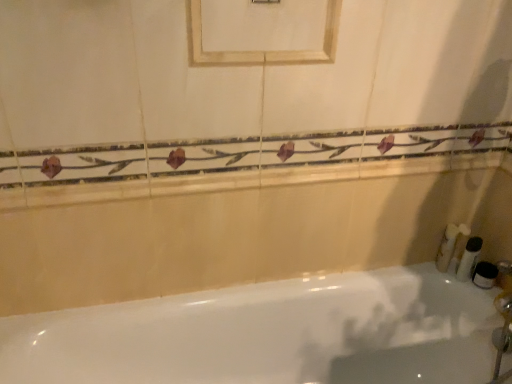
Question: Does white plastic bottle at right, acting as the third toiletry starting from the left, have a lesser width compared to white matte toothbrushes at right, which is the third toiletry from right to left?

Choices:
 (A) no
 (B) yes

Answer: (B)

Question: Can we say white plastic bottle at right, the second toiletry from the right, lies outside white matte toothbrushes at right, which is the third toiletry from right to left?

Choices:
 (A) yes
 (B) no

Answer: (A)

Question: From the image's perspective, is white plastic bottle at right, acting as the third toiletry starting from the left, located beneath white matte toothbrushes at right, which is the third toiletry from right to left?

Choices:
 (A) no
 (B) yes

Answer: (B)

Question: Does white plastic bottle at right, the second toiletry from the right, appear on the right side of white matte toothbrushes at right, which is the third toiletry from right to left?

Choices:
 (A) no
 (B) yes

Answer: (B)

Question: Considering the relative sizes of white plastic bottle at right, the second toiletry from the right, and white matte toothbrushes at right, which is the 2th toiletry in left-to-right order, in the image provided, is white plastic bottle at right, the second toiletry from the right, taller than white matte toothbrushes at right, which is the 2th toiletry in left-to-right order,?

Choices:
 (A) yes
 (B) no

Answer: (B)

Question: From the image's perspective, is white plastic bottle at right, acting as the third toiletry starting from the left, on top of white matte toothbrushes at right, which is the 2th toiletry in left-to-right order?

Choices:
 (A) no
 (B) yes

Answer: (A)

Question: Does porcelain tile balustrade at upper center appear on the right side of white matte toothbrushes at right, which is the third toiletry from right to left?

Choices:
 (A) yes
 (B) no

Answer: (B)

Question: Considering the relative sizes of porcelain tile balustrade at upper center and white matte toothbrushes at right, which is the third toiletry from right to left, in the image provided, is porcelain tile balustrade at upper center thinner than white matte toothbrushes at right, which is the third toiletry from right to left,?

Choices:
 (A) no
 (B) yes

Answer: (B)

Question: From a real-world perspective, is porcelain tile balustrade at upper center on white matte toothbrushes at right, which is the 2th toiletry in left-to-right order?

Choices:
 (A) yes
 (B) no

Answer: (A)

Question: Can you confirm if porcelain tile balustrade at upper center is shorter than white matte toothbrushes at right, which is the third toiletry from right to left?

Choices:
 (A) yes
 (B) no

Answer: (A)

Question: From a real-world perspective, does porcelain tile balustrade at upper center sit lower than white matte toothbrushes at right, which is the 2th toiletry in left-to-right order?

Choices:
 (A) no
 (B) yes

Answer: (A)

Question: Is white matte toothbrushes at right, which is the third toiletry from right to left, at the back of porcelain tile balustrade at upper center?

Choices:
 (A) yes
 (B) no

Answer: (B)

Question: Is white fluffy sponge at right, arranged as the 4th toiletry when viewed from the right, oriented away from white matte toothbrushes at right, which is the 2th toiletry in left-to-right order?

Choices:
 (A) no
 (B) yes

Answer: (A)